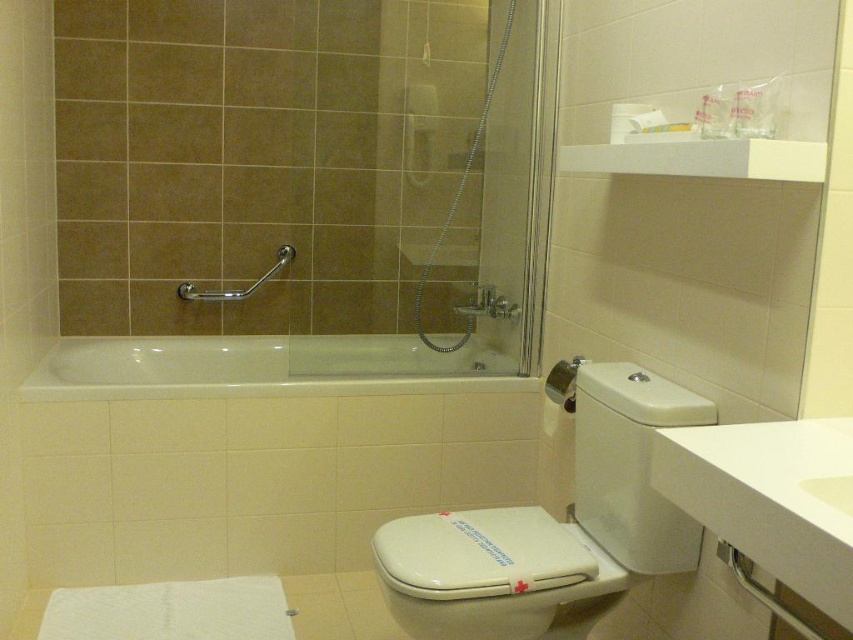
Question: Can you confirm if white glossy toilet at lower right is positioned above white glossy bathtub at center?

Choices:
 (A) no
 (B) yes

Answer: (A)

Question: Which is farther from the white glossy bathtub at center?

Choices:
 (A) white glossy sink at lower right
 (B) satin nickel grab bar at upper left
 (C) white glossy toilet at lower right

Answer: (A)

Question: Does white glossy toilet at lower right lie behind white glossy sink at lower right?

Choices:
 (A) no
 (B) yes

Answer: (B)

Question: Is white glossy toilet at lower right thinner than white glossy bathtub at center?

Choices:
 (A) no
 (B) yes

Answer: (B)

Question: Among these objects, which one is farthest from the camera?

Choices:
 (A) satin nickel grab bar at upper left
 (B) white glossy toilet at lower right

Answer: (A)

Question: Which object is farther from the camera taking this photo?

Choices:
 (A) white glossy toilet at lower right
 (B) white glossy bathtub at center

Answer: (B)